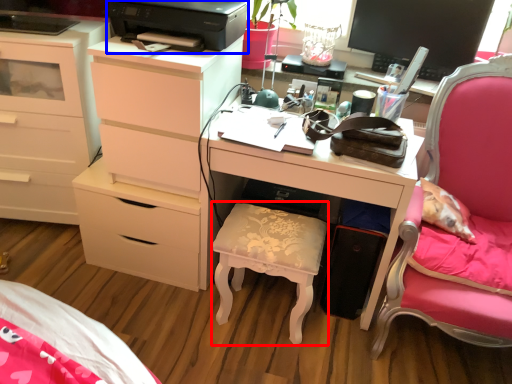
Question: Which point is closer to the camera, stool (highlighted by a red box) or printer (highlighted by a blue box)?

Choices:
 (A) stool
 (B) printer

Answer: (B)